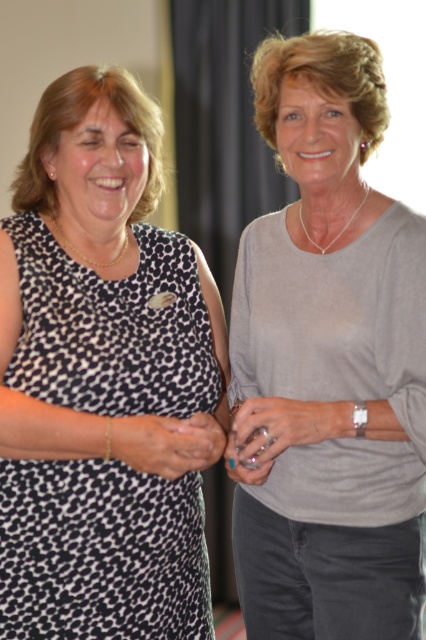
Question: Which of the following is the closest to the observer?

Choices:
 (A) gray matte shirt at center
 (B) black leopard print dress at left

Answer: (B)

Question: Is black leopard print dress at left to the left of gray matte shirt at center from the viewer's perspective?

Choices:
 (A) no
 (B) yes

Answer: (B)

Question: Does black leopard print dress at left appear on the left side of gray matte shirt at center?

Choices:
 (A) yes
 (B) no

Answer: (A)

Question: Is black leopard print dress at left below gray matte shirt at center?

Choices:
 (A) no
 (B) yes

Answer: (B)